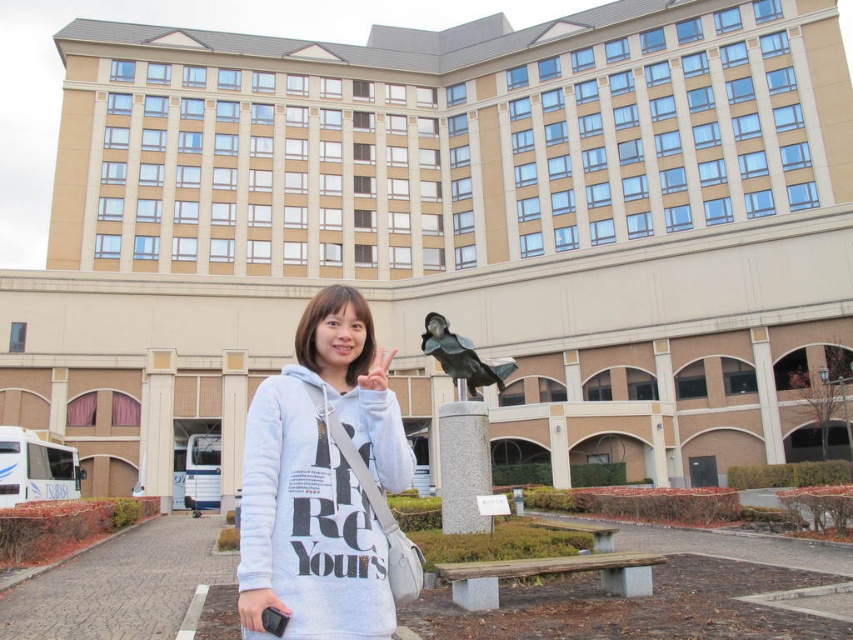
You are a photographer trying to capture a photo of both the white cotton hoodie at center and the shiny black bird at center in the same frame. Based on their positions, which object should you adjust your camera to focus on first to ensure both are in the frame?

The white cotton hoodie at center is to the left of shiny black bird at center, so you should focus on the shiny black bird at center first to ensure both objects are included in the frame.

You are a photographer trying to capture the statue behind the person wearing the white cotton hoodie at center. Based on the coordinates provided, where should you position yourself relative to the person to ensure the statue is fully visible in the frame?

The white cotton hoodie at center is located at coordinates point (320, 483). To capture the statue behind them, position yourself to the right side of the person since the statue is behind them and the hoodie is centered, allowing the statue to be in the background without obstruction.